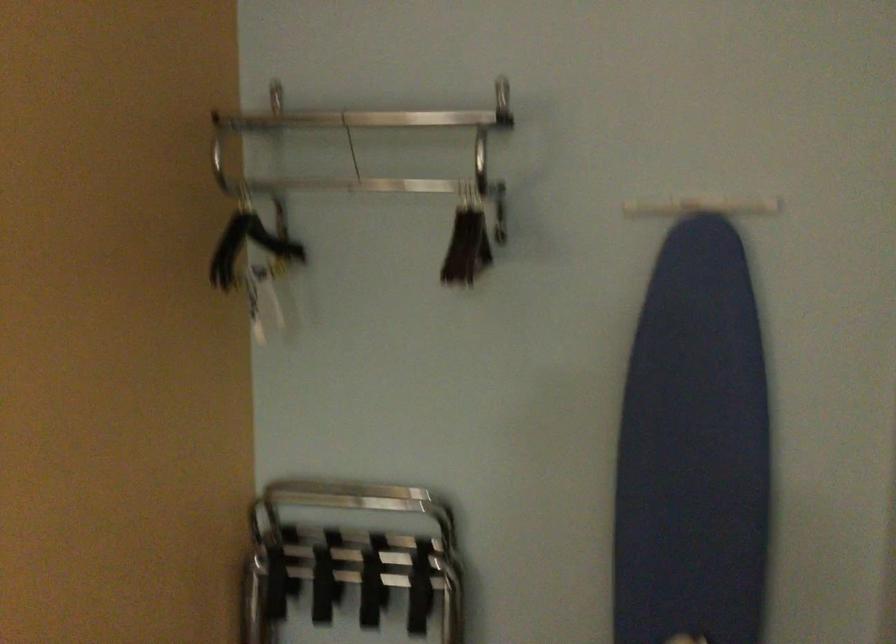
Where would you lift the black clip hanger? Please return your answer as a coordinate pair (x, y).

(467, 245)